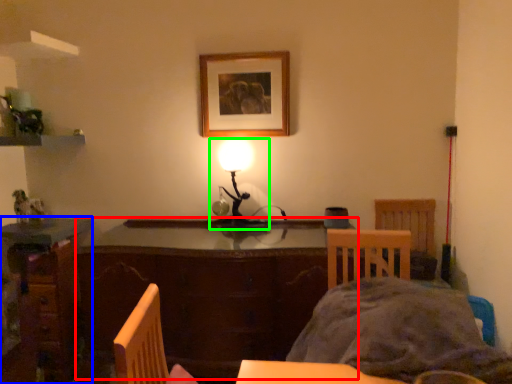
Question: Which is nearer to the table (highlighted by a red box)? desk (highlighted by a blue box) or lamp (highlighted by a green box).

Choices:
 (A) desk
 (B) lamp

Answer: (A)